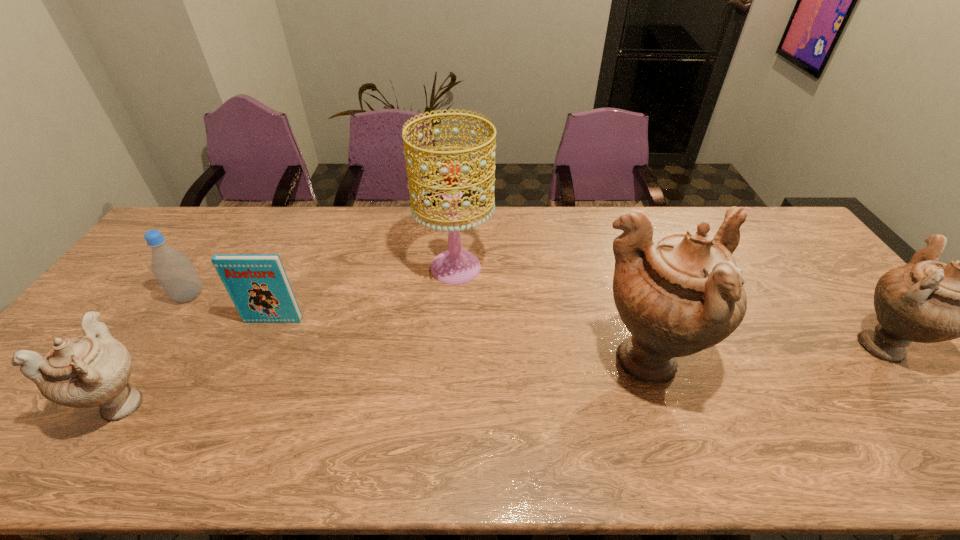
To make them evenly spaced by inserting another urn among them, please locate a vacant spot for this new urn. Please provide its 2D coordinates. Your answer should be formatted as a tuple, i.e. [(x, y)], where the tuple contains the x and y coordinates of a point satisfying the conditions above.

[(396, 382)]